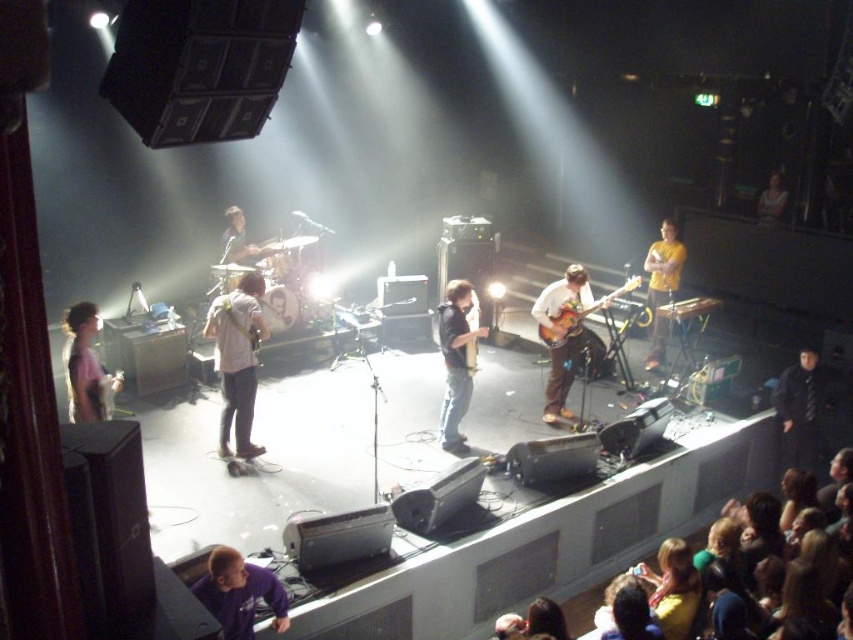
Question: Is white matte guitar at center further to the viewer compared to light blue shirt at center?

Choices:
 (A) no
 (B) yes

Answer: (A)

Question: Which object is positioned farthest from the yellow casual clothing at lower right?

Choices:
 (A) wooden acoustic guitar at center
 (B) white matte guitar at center
 (C) pink matte shirt at left

Answer: (C)

Question: Which of the following is the closest to the observer?

Choices:
 (A) purple fleece at lower left
 (B) yellow matte shirt at center
 (C) matte brown electric guitar at center

Answer: (A)

Question: Does yellow casual clothing at lower right appear on the left side of matte brown electric guitar at center?

Choices:
 (A) no
 (B) yes

Answer: (B)

Question: Does pink matte shirt at left appear on the left side of matte brown electric guitar at center?

Choices:
 (A) no
 (B) yes

Answer: (B)

Question: Which object is positioned closest to the yellow matte shirt at center?

Choices:
 (A) yellow casual clothing at lower right
 (B) light blue shirt at center
 (C) white matte guitar at center
 (D) matte brown guitar at center

Answer: (D)